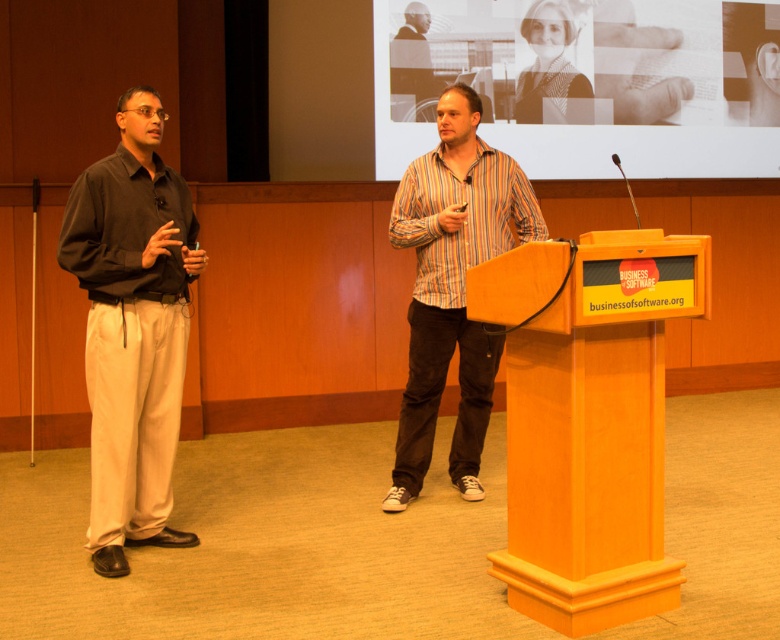
Based on the scene description, can you determine which object is bigger between the wooden podium at center and the dark brown cotton shirt at left?

The wooden podium at center is larger in size than the dark brown cotton shirt at left.

What is the 2D coordinate of the wooden podium at center?

The wooden podium at center is located at the 2D coordinate point of (587, 419).

You are a photographer standing at the camera position. You want to take a closeup shot of the brown textured fabric at upper center. Considering the distance, can you use a standard zoom lens with a maximum focal length of 200mm? Assume the camera sensor size is full frame and the distance to the subject is 5.45 meters. The standard zoom lens has a maximum focal length of 200mm. The subject is 0.5 meters in height. The minimum focal length required to fill the frame vertically is calculated as follows. The

The minimum focal length required to fill the frame vertically is calculated as follows. The sensor height of a full frame camera is approximately 24mm. The subject height is 0.5 meters, which is 500mm. Using the formula focal length needed is sensor height multiplied by distance divided by subject height. So 24mm x 5450mm divided by 500mm equals approximately 264mm. Since the lens only goes up to 200mm, it won not be sufficient to fill the frame. You will need a longer lens.